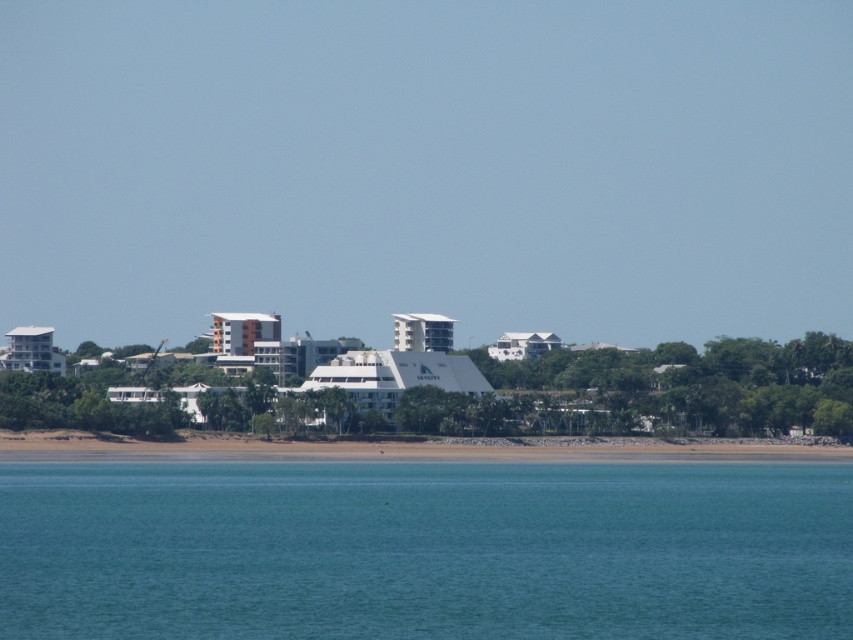
You are standing in front of the white matte building at center and the white glossy building at center. Which building would appear larger to you?

The white matte building at center appears larger because it is closer to the viewer than the white glossy building at center.

You are standing at the point marked by point (425, 548) in the coastal scene. Looking around, you see the clear blue water at lower center and the line of buildings and greenery in the background. Which direction should you walk to reach the buildings?

Since point (425, 548) represents the clear blue water at lower center, you should walk northward towards the buildings and greenery located in the background to reach them.

You are a city planner analyzing the coastal area. You need to determine which building has a greater width between the white matte building at center and the white glossy building at center. Which one is wider?

The white matte building at center is wider than the white glossy building at center according to the description.